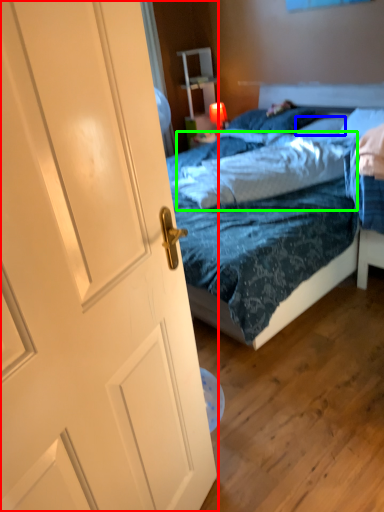
Question: Estimate the real-world distances between objects in this image. Which object is closer to door (highlighted by a red box), pillow (highlighted by a blue box) or sheet (highlighted by a green box)?

Choices:
 (A) pillow
 (B) sheet

Answer: (B)